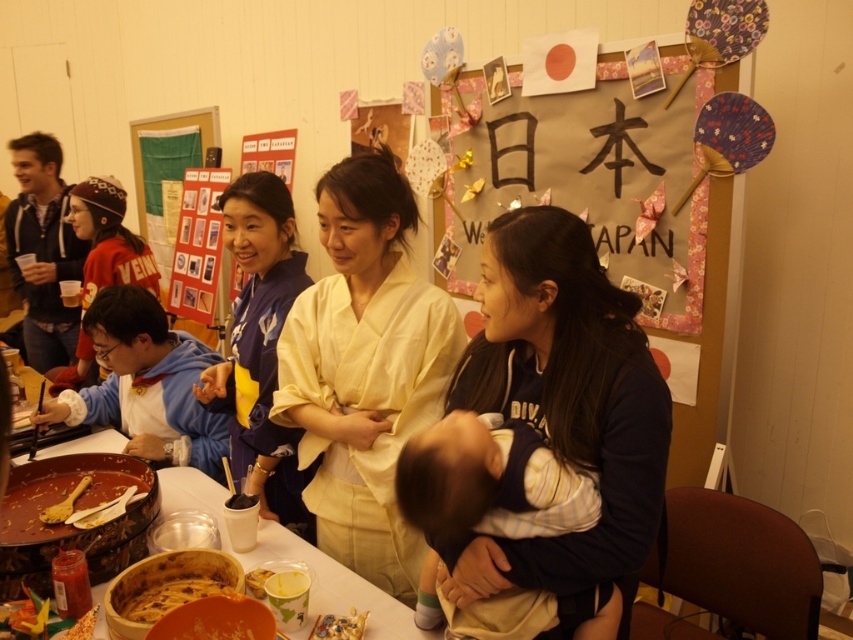
Does point (280, 291) lie behind point (64, 237)?

No, it is not.

Consider the image. Is the position of blue silk kimono at center more distant than that of matte black robe at left?

No, it is not.

Does point (270, 301) come behind point (28, 268)?

No, it is not.

You are a GUI agent. You are given a task and a screenshot of the screen. Output one action in this format:
    pyautogui.click(x=<x>, y=<y>)
    Task: Click on the blue silk kimono at center
    Image resolution: width=853 pixels, height=640 pixels.
    Given the screenshot: What is the action you would take?
    pyautogui.click(x=264, y=388)

Is soft beige baby at center above shiny plastic toy at lower center?

Yes.

Where is `soft beige baby at center`? soft beige baby at center is located at coordinates (488, 483).

Measure the distance between point (x=462, y=416) and camera.

A distance of 3.95 feet exists between point (x=462, y=416) and camera.

Find the location of a particular element. soft beige baby at center is located at coordinates (488, 483).

Which is below, dark blue fleece at center or blue silk kimono at center?

Positioned lower is dark blue fleece at center.

Which is more to the left, dark blue fleece at center or blue silk kimono at center?

Positioned to the left is blue silk kimono at center.

Which is behind, point (630, 304) or point (244, 289)?

Point (244, 289)

Identify the location of dark blue fleece at center. (561, 412).